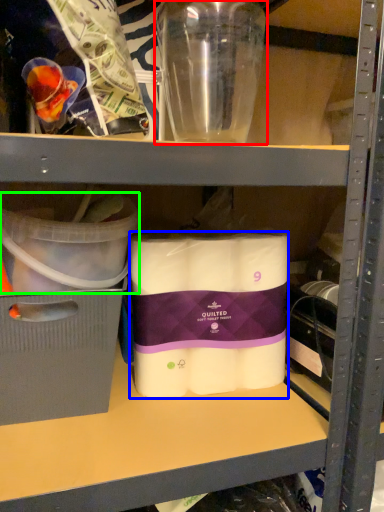
Question: Which is nearer to the bottle (highlighted by a red box)? toilet paper (highlighted by a blue box) or storage box (highlighted by a green box).

Choices:
 (A) toilet paper
 (B) storage box

Answer: (B)